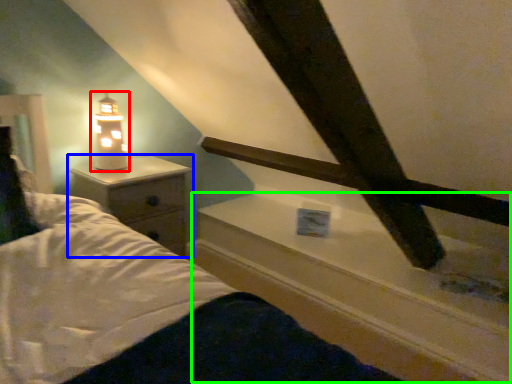
Question: Which object is positioned farthest from lamp (highlighted by a red box)? Select from nightstand (highlighted by a blue box) and window sill (highlighted by a green box).

Choices:
 (A) nightstand
 (B) window sill

Answer: (B)